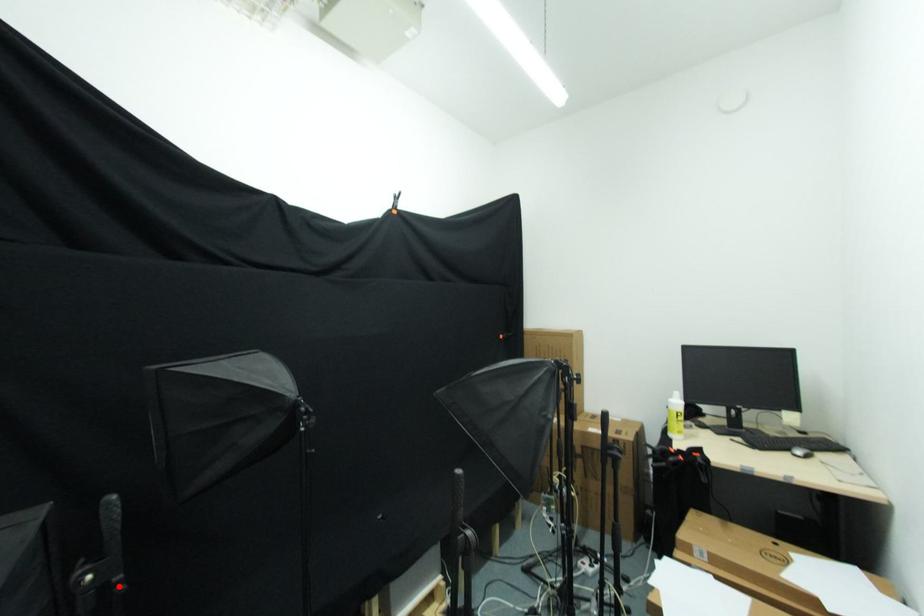
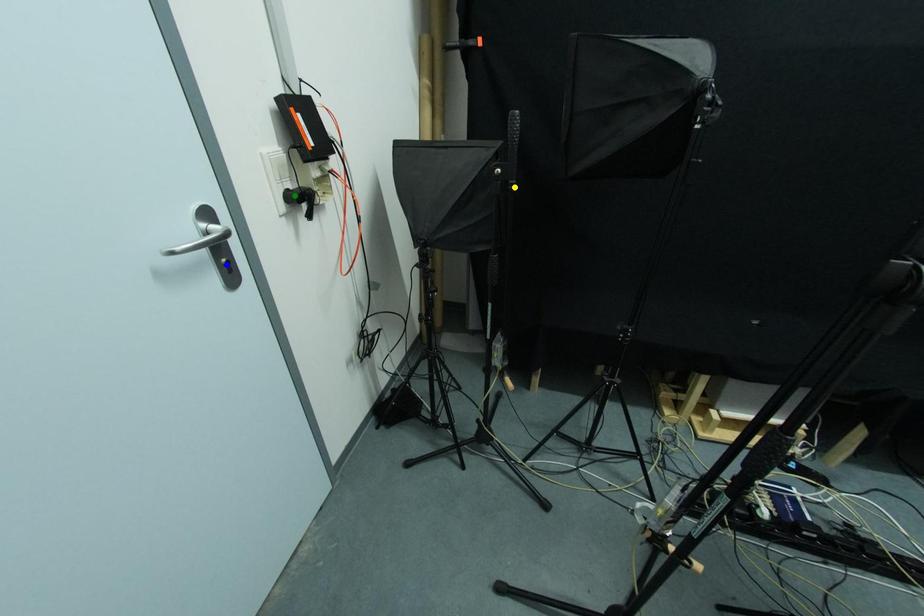
Question: I am providing you with two images of the same scene from different viewpoints. A red point is marked on the first image. You are given multiple points on the second image. Which mark in image 2 goes with the point in image 1?

Choices:
 (A) green point
 (B) blue point
 (C) yellow point

Answer: (C)